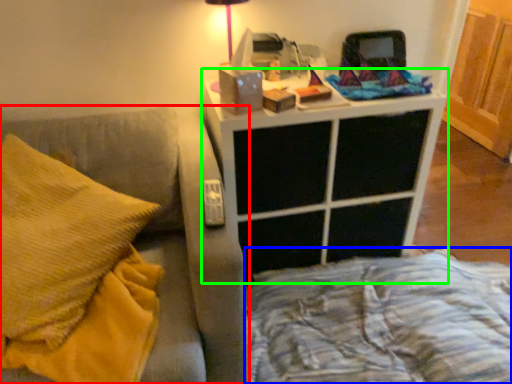
Question: Which object is the closest to the furniture (highlighted by a red box)? Choose among these: bed frame (highlighted by a blue box) or nightstand (highlighted by a green box).

Choices:
 (A) bed frame
 (B) nightstand

Answer: (B)